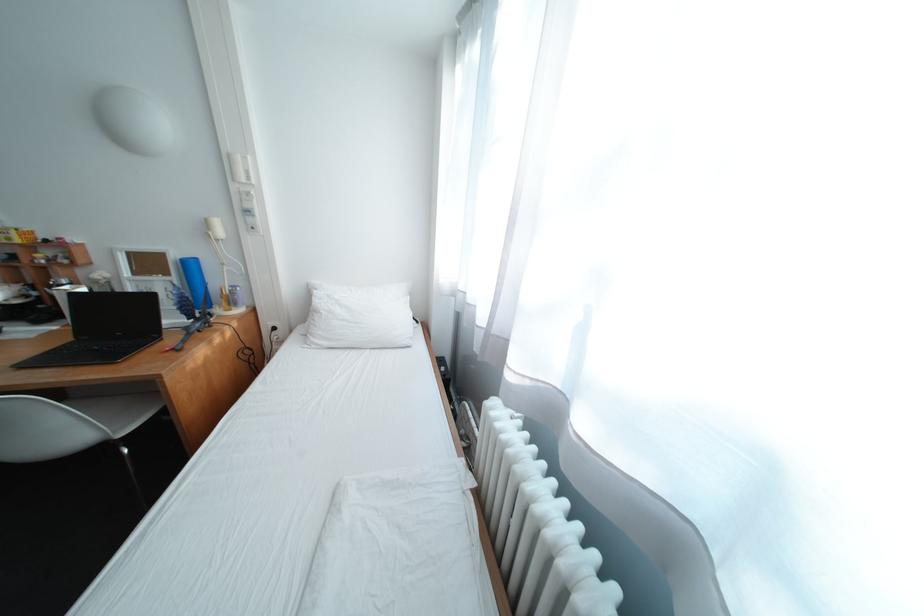
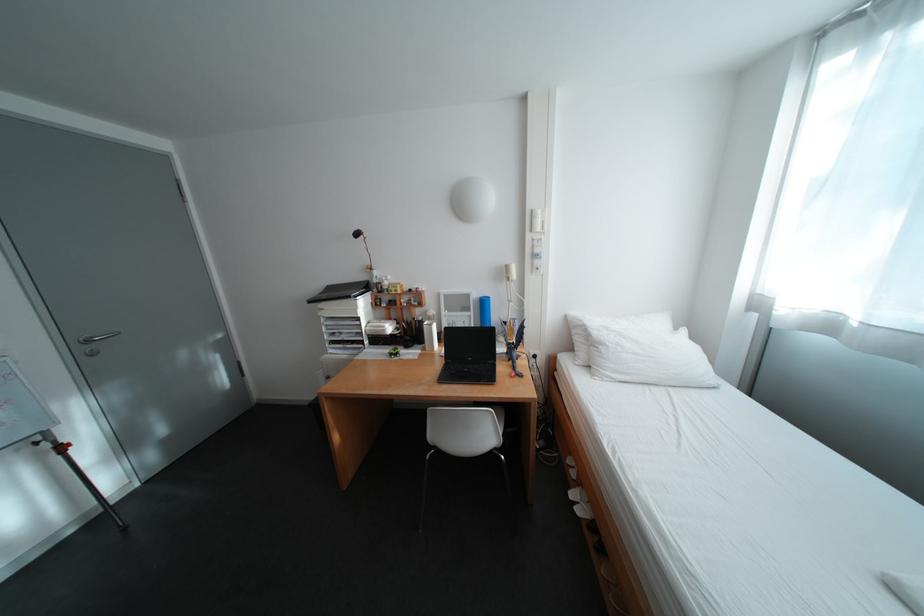
Where in the second image is the point corresponding to pixel 242 156 from the first image?

(544, 213)